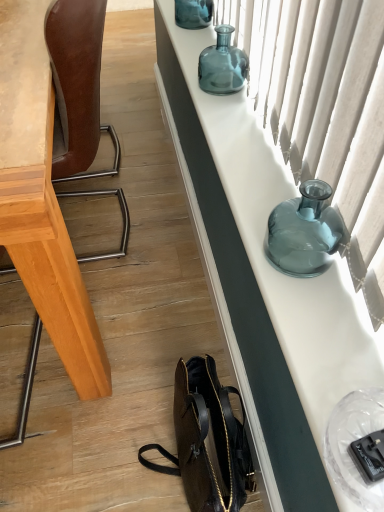
The width and height of the screenshot is (384, 512). I want to click on vacant area that lies between brown leather chair at left and brown leather handbag at lower center, so click(147, 330).